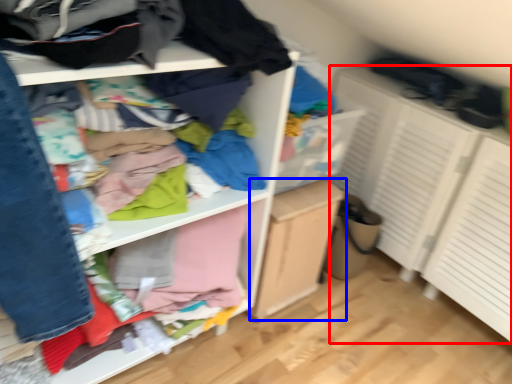
Question: Among these objects, which one is farthest to the camera, cabinetry (highlighted by a red box) or file cabinet (highlighted by a blue box)?

Choices:
 (A) cabinetry
 (B) file cabinet

Answer: (B)